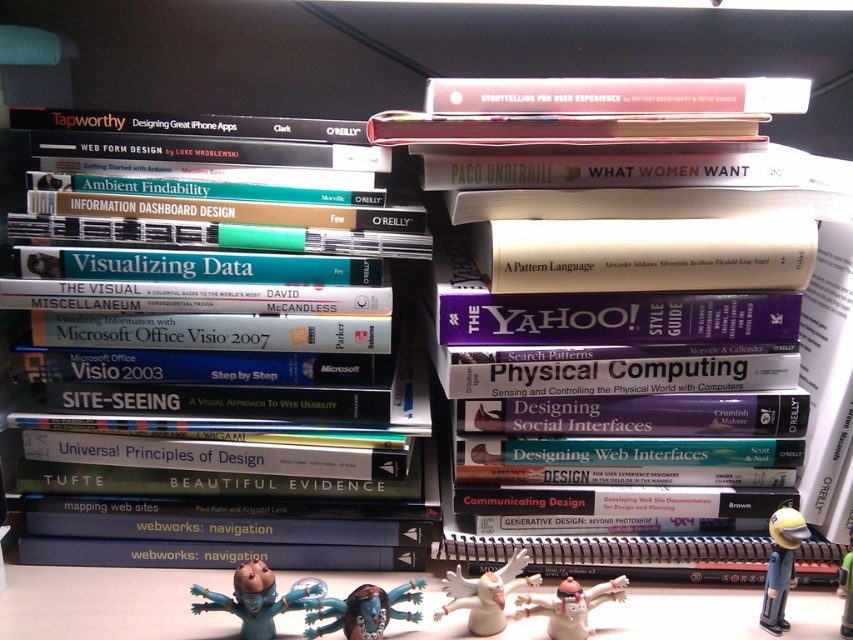
You are looking at the shelf with books and figurines. There are two points marked on the shelf. The first point is at coordinate (x=325, y=406) and the second is at (x=270, y=582). From your perspective, which point is closer to you?

Point (x=270, y=582) is closer to you because point (x=325, y=406) is behind it.

You are organizing a shelf and want to place the matte pink book at upper center and the teal matte figurine at lower center. Which object should you place first if you want to ensure there is enough space for both?

You should place the matte pink book at upper center first because it might be wider than the teal matte figurine at lower center, so placing it first ensures there is enough space for both.